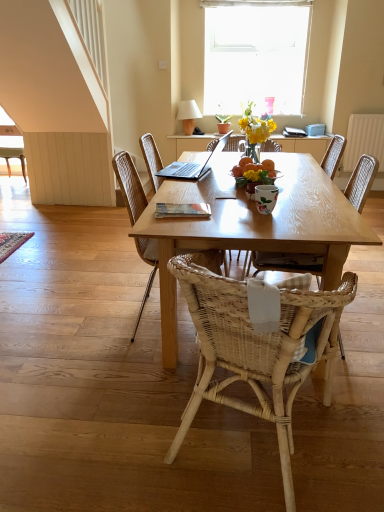
Identify the location of vacant space underneath woven wood chair at center, which appears as the fourth chair when viewed from the back (from a real-world perspective). (262, 436).